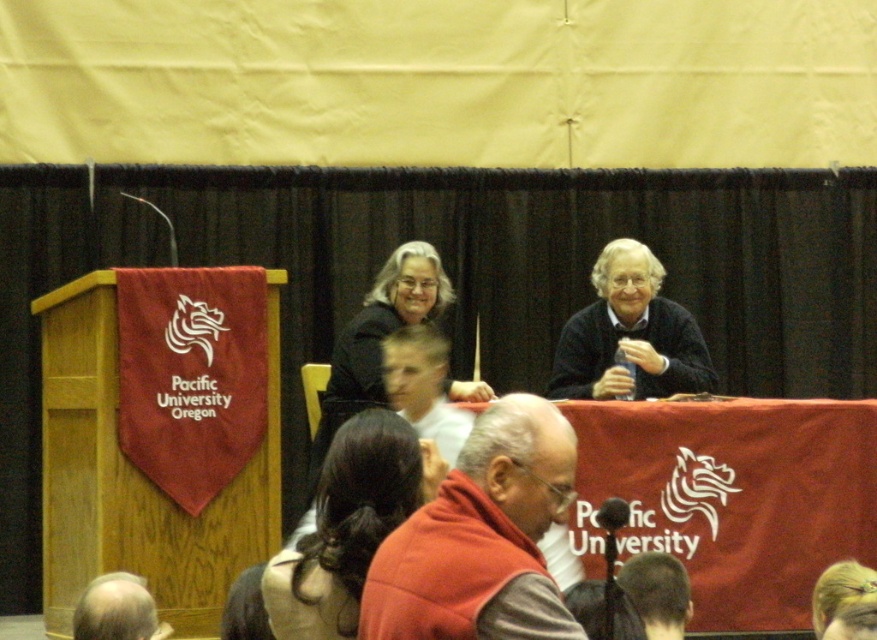
You are an attendee at this event and want to locate the speaker wearing the red sweater vest at center. According to the coordinates provided, where should you look on the screen?

You should look at point (481, 538) on the screen to find the red sweater vest at center.

From the picture: You are an attendee at this event and want to take a photo of both the matte black sweater at upper center and the smooth white shirt at center. Which one should you focus on first to ensure both are in the frame?

You should focus on the matte black sweater at upper center first because it is closer to you than the smooth white shirt at center, so adjusting the camera to include it will also capture the other shirt in the background.

What is the position of the point with coordinates (481, 538) in the image?

The point with coordinates (481, 538) is located on the red sweater vest at center.